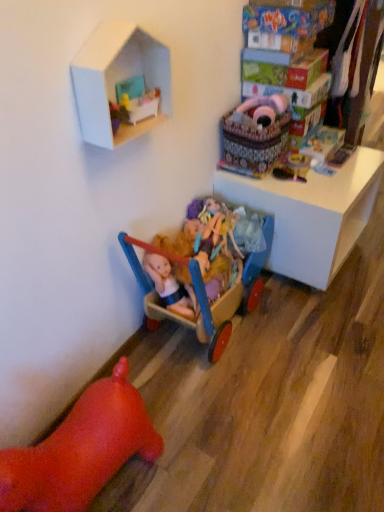
Question: Should I look upward or downward to see wooden toy car at upper right, the first toy when ordered from right to left?

Choices:
 (A) down
 (B) up

Answer: (B)

Question: Should I look upward or downward to see wooden doll carriage at center, which is the sixth toy in right-to-left order?

Choices:
 (A) down
 (B) up

Answer: (B)

Question: From the image's perspective, is wooden doll carriage at center, positioned as the second toy in left-to-right order, on rubber pig at lower left, the 1th toy when ordered from left to right?

Choices:
 (A) yes
 (B) no

Answer: (A)

Question: Can you confirm if wooden doll carriage at center, positioned as the second toy in left-to-right order, is taller than rubber pig at lower left, the 1th toy when ordered from left to right?

Choices:
 (A) yes
 (B) no

Answer: (B)

Question: Considering the relative sizes of wooden doll carriage at center, which is the sixth toy in right-to-left order, and rubber pig at lower left, the seventh toy viewed from the right, in the image provided, is wooden doll carriage at center, which is the sixth toy in right-to-left order, wider than rubber pig at lower left, the seventh toy viewed from the right,?

Choices:
 (A) yes
 (B) no

Answer: (A)

Question: Is rubber pig at lower left, the seventh toy viewed from the right, completely or partially inside wooden doll carriage at center, positioned as the second toy in left-to-right order?

Choices:
 (A) yes
 (B) no

Answer: (B)

Question: Is wooden doll carriage at center, positioned as the second toy in left-to-right order, shorter than rubber pig at lower left, the 1th toy when ordered from left to right?

Choices:
 (A) no
 (B) yes

Answer: (B)

Question: Is wooden doll carriage at center, which is the sixth toy in right-to-left order, facing towards rubber pig at lower left, the seventh toy viewed from the right?

Choices:
 (A) no
 (B) yes

Answer: (B)

Question: Is velvet pink baby carriage at upper right, which is counted as the 5th toy, starting from the left, surrounded by wooden doll carriage at upper center, which is counted as the 4th toy, starting from the right?

Choices:
 (A) yes
 (B) no

Answer: (B)

Question: Does wooden doll carriage at upper center, acting as the 4th toy starting from the left, have a smaller size compared to velvet pink baby carriage at upper right, which is counted as the 5th toy, starting from the left?

Choices:
 (A) yes
 (B) no

Answer: (A)

Question: Considering the relative positions of wooden doll carriage at upper center, acting as the 4th toy starting from the left, and velvet pink baby carriage at upper right, which is counted as the 5th toy, starting from the left, in the image provided, is wooden doll carriage at upper center, acting as the 4th toy starting from the left, to the right of velvet pink baby carriage at upper right, which is counted as the 5th toy, starting from the left, from the viewer's perspective?

Choices:
 (A) yes
 (B) no

Answer: (B)

Question: Can you confirm if wooden doll carriage at upper center, acting as the 4th toy starting from the left, is shorter than velvet pink baby carriage at upper right, which is counted as the 5th toy, starting from the left?

Choices:
 (A) yes
 (B) no

Answer: (A)

Question: Is wooden doll carriage at upper center, acting as the 4th toy starting from the left, bigger than velvet pink baby carriage at upper right, which is counted as the 5th toy, starting from the left?

Choices:
 (A) no
 (B) yes

Answer: (A)

Question: Does wooden doll carriage at upper center, acting as the 4th toy starting from the left, turn towards velvet pink baby carriage at upper right, which is counted as the 5th toy, starting from the left?

Choices:
 (A) yes
 (B) no

Answer: (A)

Question: Is the position of wooden toy car at upper right, the first toy when ordered from right to left, less distant than that of velvet pink baby carriage at upper right, the third toy positioned from the right?

Choices:
 (A) no
 (B) yes

Answer: (A)